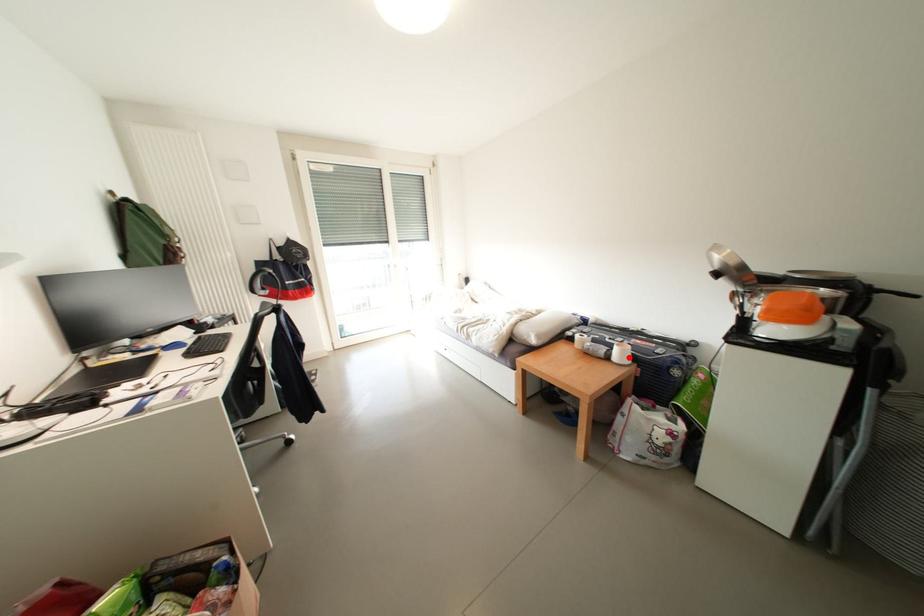
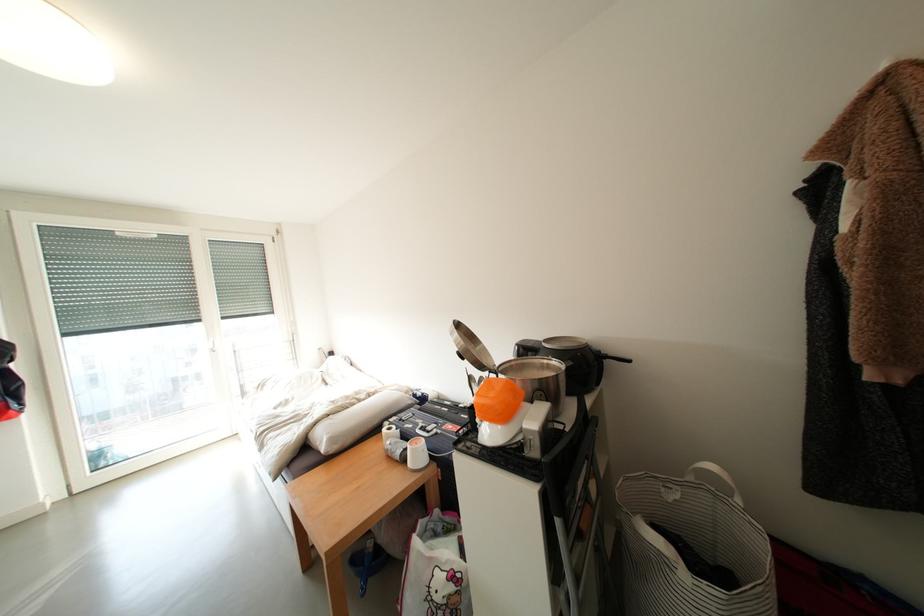
The point at the highlighted location is marked in the first image. Where is the corresponding point in the second image?

(424, 456)